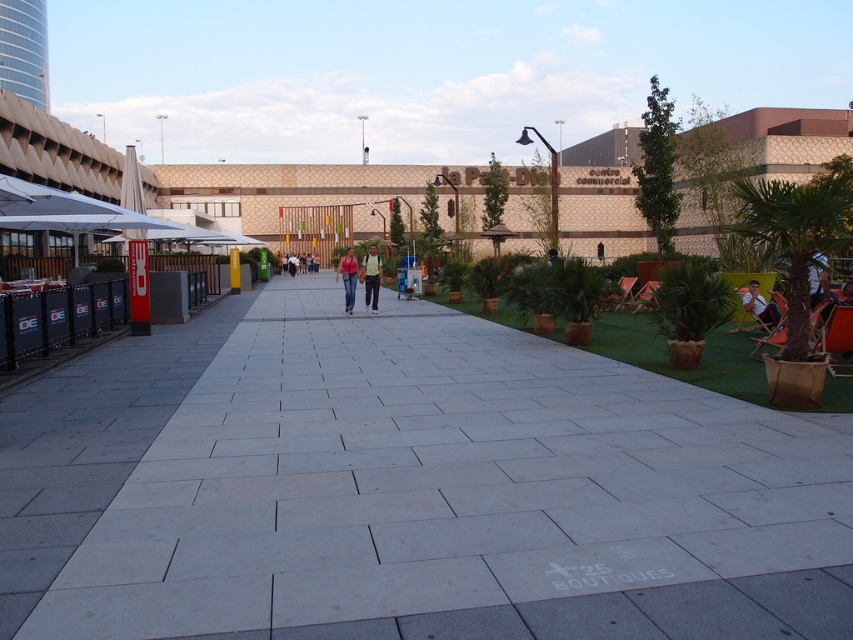
Can you confirm if gray concrete pavement at center is bigger than green fabric chair at center?

Indeed, gray concrete pavement at center has a larger size compared to green fabric chair at center.

This screenshot has width=853, height=640. Identify the location of gray concrete pavement at center. (409, 488).

Can you confirm if green cotton shirt at center is positioned above white fabric chair at right?

Indeed, green cotton shirt at center is positioned over white fabric chair at right.

Based on the photo, which of these two, green cotton shirt at center or white fabric chair at right, stands taller?

With more height is green cotton shirt at center.

Who is more distant from viewer, [364,266] or [828,292]?

The point [364,266] is more distant.

You are a GUI agent. You are given a task and a screenshot of the screen. Output one action in this format:
    pyautogui.click(x=<x>, y=<y>)
    Task: Click on the green cotton shirt at center
    The height and width of the screenshot is (640, 853).
    Given the screenshot: What is the action you would take?
    pyautogui.click(x=370, y=276)

Is light brown leather chair at right further to the viewer compared to brown woven chair at center-right?

That is False.

Who is higher up, light brown leather chair at right or brown woven chair at center-right?

brown woven chair at center-right

Does point (752, 308) lie in front of point (612, 304)?

Yes.

This screenshot has height=640, width=853. Find the location of `light brown leather chair at right`. light brown leather chair at right is located at coordinates (759, 305).